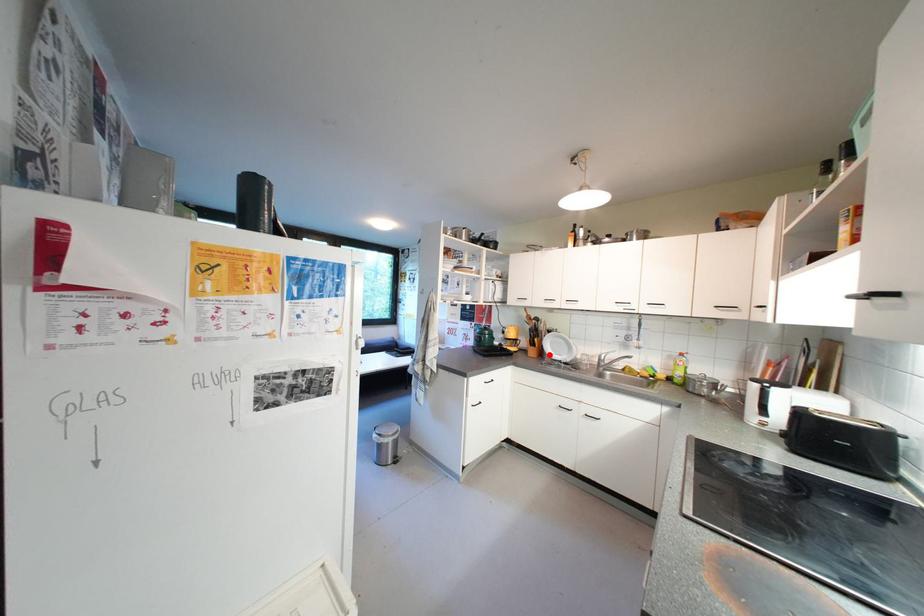
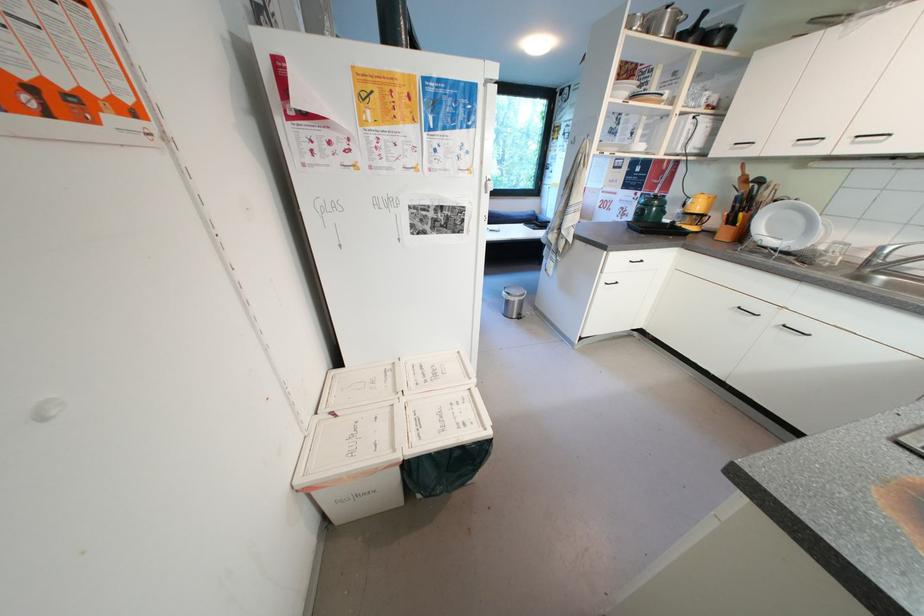
Locate, in the second image, the point that corresponds to the highlighted location in the first image.

(749, 238)